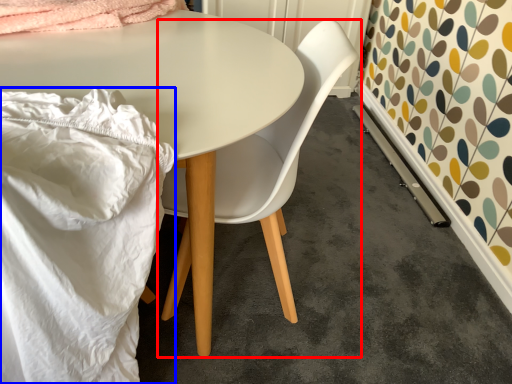
Question: Which point is closer to the camera, chair (highlighted by a red box) or blanket (highlighted by a blue box)?

Choices:
 (A) chair
 (B) blanket

Answer: (B)